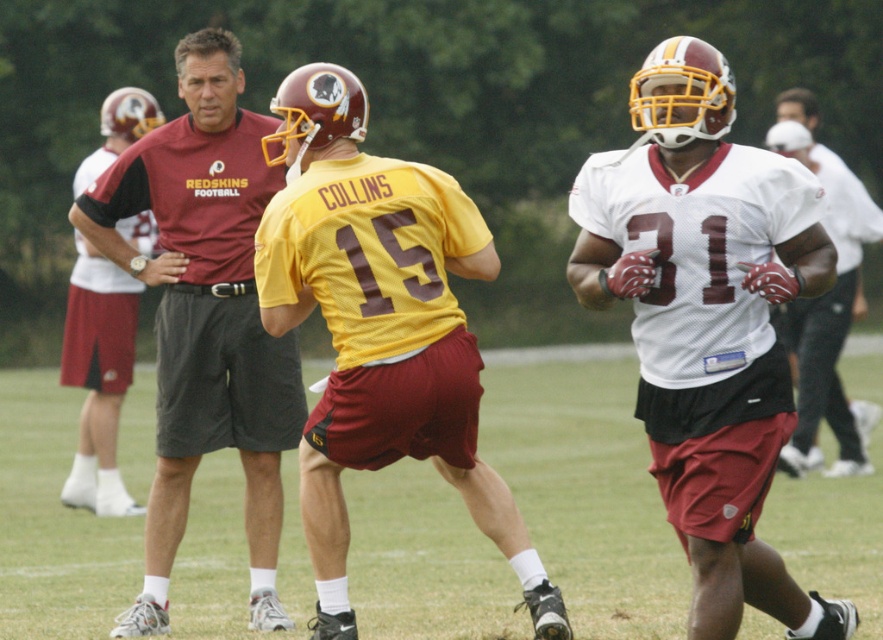
Question: Among these points, which one is farthest from the camera?

Choices:
 (A) pos(261,284)
 (B) pos(770,406)
 (C) pos(102,296)

Answer: (C)

Question: Estimate the real-world distances between objects in this image. Which object is closer to the maroon shirt at upper left?

Choices:
 (A) white matte jersey at right
 (B) green grass at center

Answer: (B)

Question: Can you confirm if white mesh jersey at center is smaller than yellow jersey at center?

Choices:
 (A) yes
 (B) no

Answer: (B)

Question: Which of the following is the closest to the observer?

Choices:
 (A) yellow jersey at center
 (B) white matte jersey at right

Answer: (A)

Question: Does yellow jersey at center appear under maroon fabric shirt at center?

Choices:
 (A) yes
 (B) no

Answer: (B)

Question: Can you confirm if white mesh jersey at center is positioned to the right of maroon fabric shirt at center?

Choices:
 (A) yes
 (B) no

Answer: (A)